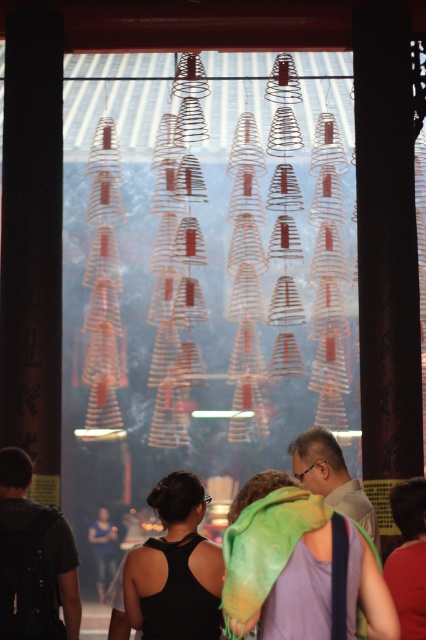
You are standing in the temple and want to place a small statue on the floor. You have two options for placement near the black backpack at lower left and the red fabric at lower right. Which location would allow the statue to be more visible to someone entering the temple from the front?

The red fabric at lower right is taller than the black backpack at lower left. Placing the statue near the red fabric at lower right would provide a higher base, making it more visible to someone entering the temple from the front.

You are standing in the temple and want to place a small offering on the floor. The multicolored scarf at center and the red fabric at lower right are both nearby. Which object is closer to the floor?

The multicolored scarf at center has a lesser height compared to red fabric at lower right, so it is closer to the floor.

You are an artist planning to paint the scene described. You need to decide which object to focus on first based on their sizes. Which object should you paint first, the black matte tank top at lower center or the red fabric at lower right?

The black matte tank top at lower center has a larger size compared to the red fabric at lower right, so you should paint the black matte tank top at lower center first to ensure proper scaling when adding the smaller red fabric at lower right later.